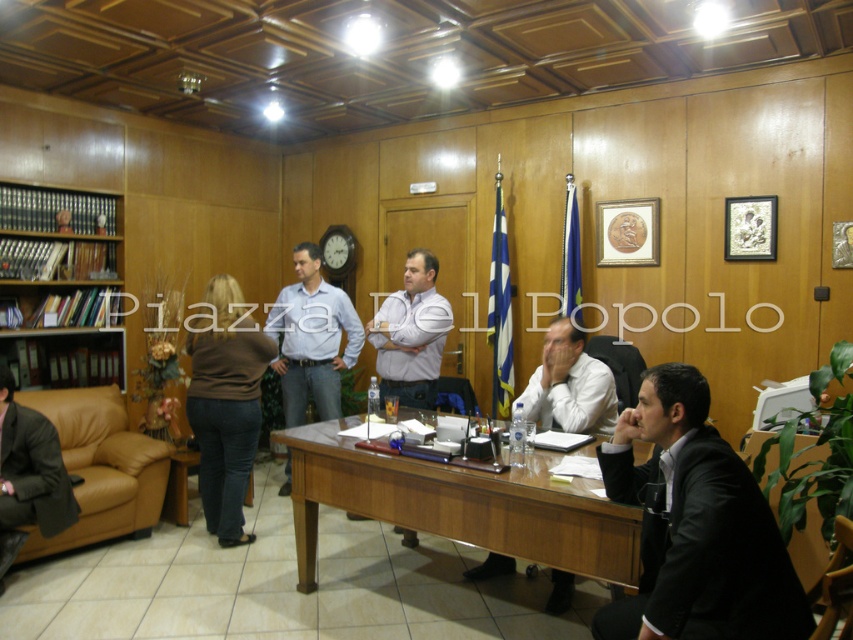
From the picture: You are standing at the entrance of the conference room and want to locate the person in the black suit at lower right. Which corner of the room should you look towards?

The black suit at lower right is located at point (695, 525), which corresponds to the lower right corner of the room. Therefore, you should look towards the lower right corner of the room to locate the person in the black suit at lower right.

You are a photographer trying to capture a candid shot of both the black suit at lower right and the dark brown leather jacket at lower left. Since you want to ensure both subjects are in focus, you need to know which one is closer to the camera. Can you determine which person is nearer to the camera based on their height in the frame?

The black suit at lower right is not as tall as dark brown leather jacket at lower left, so the dark brown leather jacket at lower left is closer to the camera.

You are attending a meeting in this room and need to place a large document on a surface. Which object, the wooden bookshelf at left or the leather couch at left, is a better choice for placing the document?

The wooden bookshelf at left is located above the leather couch at left, so placing the document on the wooden bookshelf at left would be more stable and accessible compared to the leather couch at left.